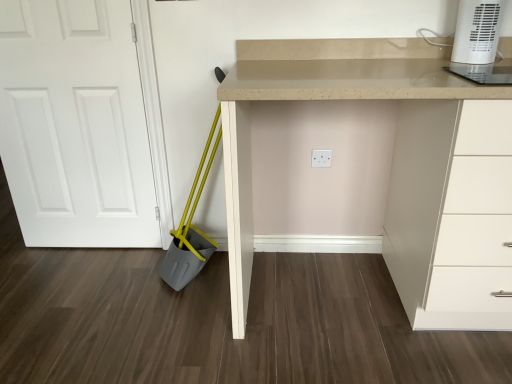
The image size is (512, 384). Describe the element at coordinates (76, 123) in the screenshot. I see `white matte door at left` at that location.

Locate an element on the screen. The height and width of the screenshot is (384, 512). white matte door at left is located at coordinates (76, 123).

At what (x,y) coordinates should I click in order to perform the action: click on white plastic heater at upper right. Please return your answer as a coordinate pair (x, y). This screenshot has height=384, width=512. Looking at the image, I should click on (477, 31).

Describe the element at coordinates (315, 99) in the screenshot. This screenshot has height=384, width=512. I see `beige laminate desk at center` at that location.

Find the location of a particular element. The width and height of the screenshot is (512, 384). white matte door at left is located at coordinates (76, 123).

Can you confirm if white matte door at left is shorter than white plastic heater at upper right?

Incorrect, the height of white matte door at left does not fall short of that of white plastic heater at upper right.

Considering the points (128, 23) and (493, 23), which point is in front, point (128, 23) or point (493, 23)?

The point (493, 23) is closer.

Does white matte door at left have a greater width compared to white plastic heater at upper right?

Incorrect, the width of white matte door at left does not surpass that of white plastic heater at upper right.

Considering the positions of objects white matte door at left and white plastic heater at upper right in the image provided, who is behind, white matte door at left or white plastic heater at upper right?

white matte door at left is further away from the camera.

Does beige laminate desk at center lie behind white plastic heater at upper right?

No, it is not.

Does beige laminate desk at center contain white plastic heater at upper right?

No, white plastic heater at upper right is located outside of beige laminate desk at center.

Where is `home appliance on the right of the beige laminate desk at center`? This screenshot has width=512, height=384. home appliance on the right of the beige laminate desk at center is located at coordinates (477, 31).

Locate an element on the screen. The width and height of the screenshot is (512, 384). door above the beige laminate desk at center (from the image's perspective) is located at coordinates (76, 123).

Which is less distant, (442, 76) or (126, 207)?

Point (442, 76) is closer to the camera than point (126, 207).

Is beige laminate desk at center far away from white matte door at left?

beige laminate desk at center is actually quite close to white matte door at left.

Could white matte door at left be considered to be inside beige laminate desk at center?

Actually, white matte door at left is outside beige laminate desk at center.

Which is in front, point (489, 17) or point (247, 70)?

The point (489, 17) is in front.

How different are the orientations of white plastic heater at upper right and beige laminate desk at center in degrees?

The facing directions of white plastic heater at upper right and beige laminate desk at center are 1.33 degrees apart.

From a real-world perspective, is white plastic heater at upper right located higher than beige laminate desk at center?

Yes, from a real-world perspective, white plastic heater at upper right is over beige laminate desk at center

Identify the location of computer desk lying below the white plastic heater at upper right (from the image's perspective). (315, 99).

Choose the correct answer: Is white plastic heater at upper right inside white matte door at left or outside it?

white plastic heater at upper right is not enclosed by white matte door at left.

Considering the relative sizes of white plastic heater at upper right and white matte door at left in the image provided, is white plastic heater at upper right bigger than white matte door at left?

No, white plastic heater at upper right is not bigger than white matte door at left.

The width and height of the screenshot is (512, 384). Find the location of `home appliance above the white matte door at left (from a real-world perspective)`. home appliance above the white matte door at left (from a real-world perspective) is located at coordinates (477, 31).

Would you say beige laminate desk at center is part of white matte door at left's contents?

No, white matte door at left does not contain beige laminate desk at center.

Is white matte door at left taller than beige laminate desk at center?

Yes, white matte door at left is taller than beige laminate desk at center.

From a real-world perspective, which object stands above the other?

In real-world perspective, white matte door at left is above.

The width and height of the screenshot is (512, 384). What are the coordinates of `computer desk that appears on the right of white matte door at left` in the screenshot? It's located at (315, 99).

Locate an element on the screen. The image size is (512, 384). door located underneath the white plastic heater at upper right (from a real-world perspective) is located at coordinates (76, 123).

This screenshot has width=512, height=384. I want to click on home appliance that is on the right side of beige laminate desk at center, so click(x=477, y=31).

From the image, which object appears to be nearer to white plastic heater at upper right, white matte door at left or beige laminate desk at center?

beige laminate desk at center.

From the image, which object appears to be nearer to white matte door at left, beige laminate desk at center or white plastic heater at upper right?

Based on the image, beige laminate desk at center appears to be nearer to white matte door at left.

Considering their positions, is beige laminate desk at center positioned closer to white plastic heater at upper right than white matte door at left?

beige laminate desk at center lies closer to white plastic heater at upper right than the other object.

Which object lies nearer to the anchor point beige laminate desk at center, white matte door at left or white plastic heater at upper right?

Based on the image, white plastic heater at upper right appears to be nearer to beige laminate desk at center.

Based on their spatial positions, is white plastic heater at upper right or beige laminate desk at center further from white matte door at left?

The object further to white matte door at left is white plastic heater at upper right.

From the image, which object appears to be nearer to beige laminate desk at center, white plastic heater at upper right or white matte door at left?

white plastic heater at upper right is positioned closer to the anchor beige laminate desk at center.

Find the location of a particular element. The height and width of the screenshot is (384, 512). computer desk between white matte door at left and white plastic heater at upper right from left to right is located at coordinates (315, 99).